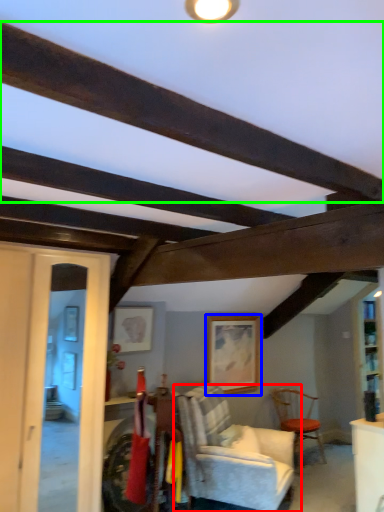
Question: Which is nearer to the chair (highlighted by a red box)? picture frame (highlighted by a blue box) or plank (highlighted by a green box).

Choices:
 (A) picture frame
 (B) plank

Answer: (A)